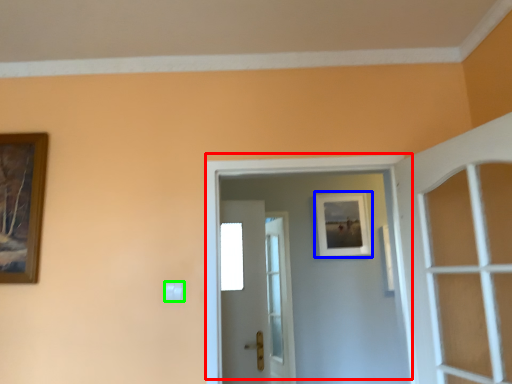
Question: Based on their relative distances, which object is farther from door (highlighted by a red box)? Choose from picture frame (highlighted by a blue box) and light switch (highlighted by a green box).

Choices:
 (A) picture frame
 (B) light switch

Answer: (A)